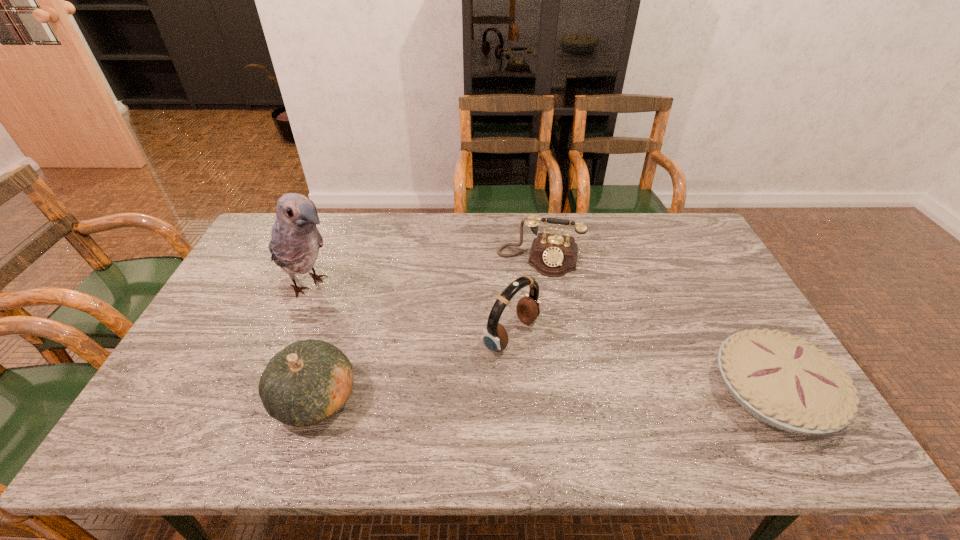
The image size is (960, 540). Find the location of `gourd`. gourd is located at coordinates (308, 382).

Where is `the rightmost object`? The height and width of the screenshot is (540, 960). the rightmost object is located at coordinates (785, 382).

The height and width of the screenshot is (540, 960). I want to click on the shortest object, so click(785, 382).

Where is `telephone`? The height and width of the screenshot is (540, 960). telephone is located at coordinates (553, 255).

You are a GUI agent. You are given a task and a screenshot of the screen. Output one action in this format:
    pyautogui.click(x=<x>, y=<y>)
    Task: Click on the parrot
    This screenshot has height=540, width=960.
    Given the screenshot: What is the action you would take?
    pyautogui.click(x=295, y=241)

Where is `headset`? This screenshot has width=960, height=540. headset is located at coordinates (495, 338).

This screenshot has height=540, width=960. I want to click on free space located on the back of the gourd, so click(349, 292).

Locate an element on the screen. Image resolution: width=960 pixels, height=540 pixels. vacant space located 0.230m on the back of the pie is located at coordinates (713, 287).

The image size is (960, 540). Identify the location of free region located 0.060m on the dial of the telephone. (531, 290).

Identify the location of free location located 0.090m on the dial of the telephone. This screenshot has width=960, height=540. (529, 296).